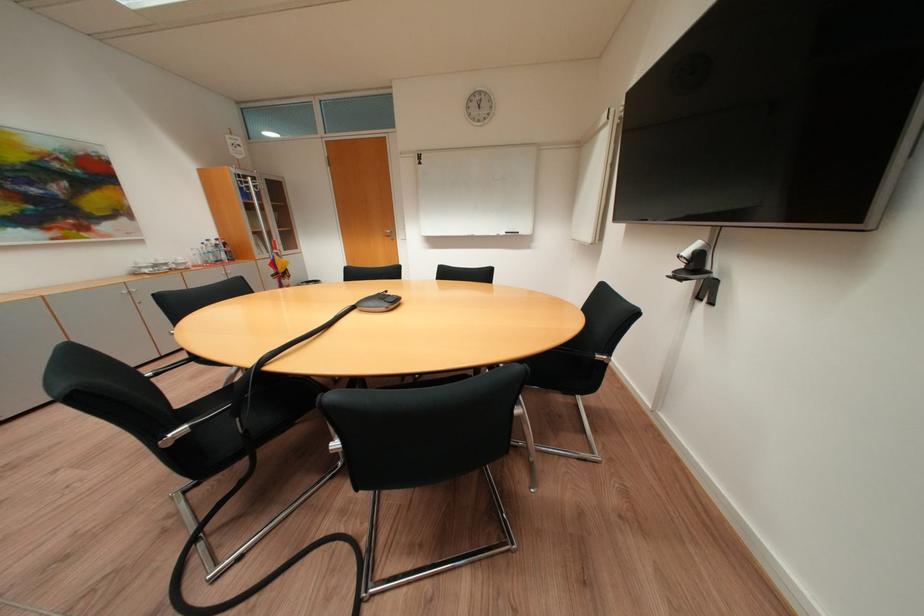
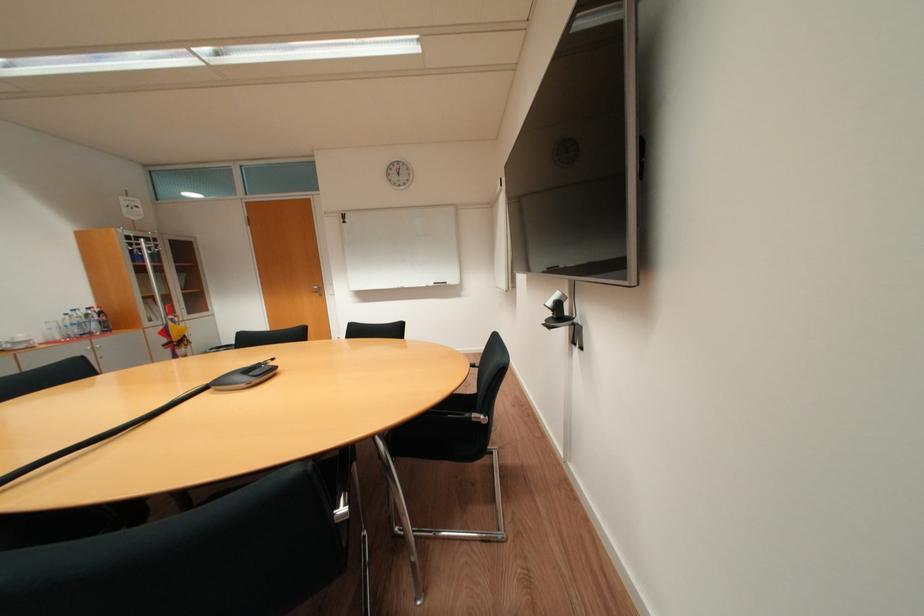
Question: How did the camera likely rotate?

Choices:
 (A) Left
 (B) Right
 (C) Up
 (D) Down

Answer: (C)